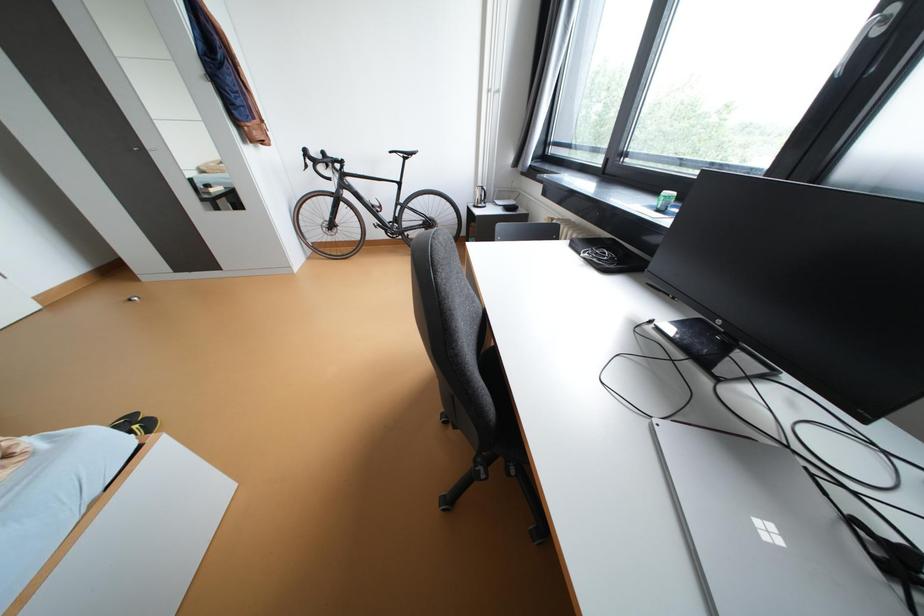
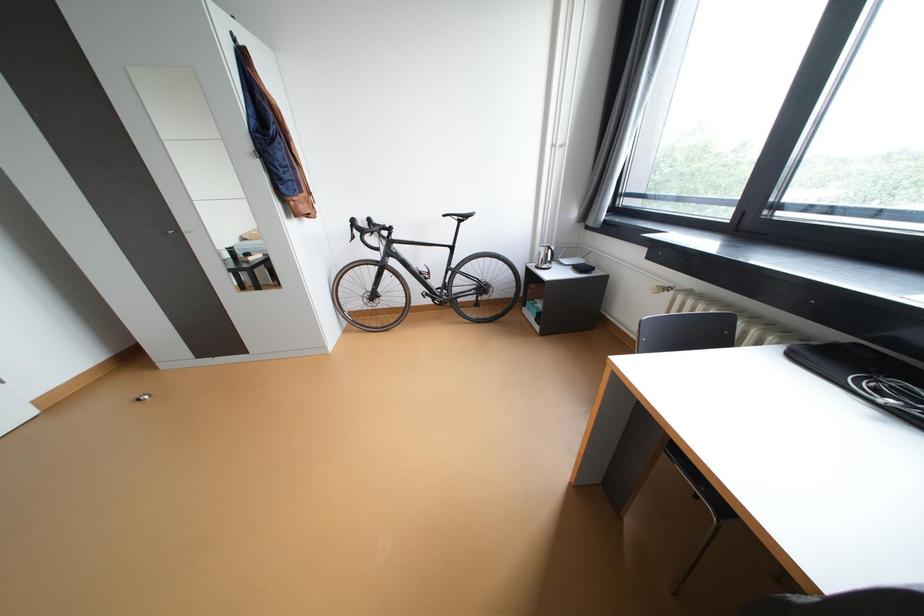
Which direction would the cameraman need to move to produce the second image?

The cameraman walked toward left, forward.